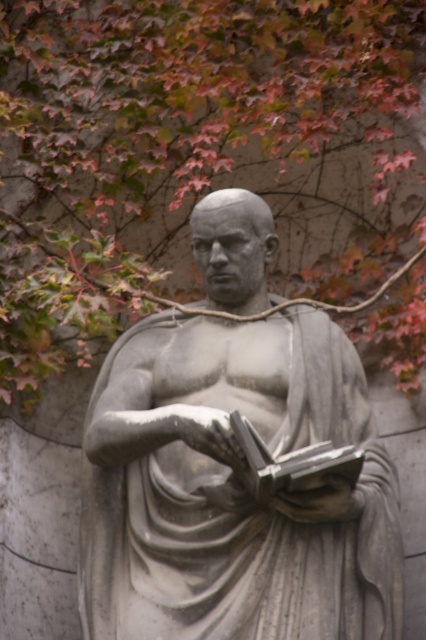
Based on the photo, you are an artist planning to sketch this scene. You want to ensure the proportions of the green leafy tree at upper center and the matte gray stone book at center are accurate. Which object should you draw first to maintain proper scale, and why?

You should draw the green leafy tree at upper center first because it is larger in size than the matte gray stone book at center, so starting with the larger object helps establish the correct scale for the smaller one.

You are an art student analyzing the statue in the image. The coordinates provided are part of your analysis. Is the point at coordinates point (233, 488) located on the gray stone statue at center?

Yes, the point (233, 488) is on the gray stone statue at center according to the description.

Looking at this image, you are an art student trying to sketch the scene. You need to know the relative positions of the gray stone statue at center and the matte gray stone book at center. Which object is positioned to the left?

The gray stone statue at center is positioned to the left of the matte gray stone book at center.